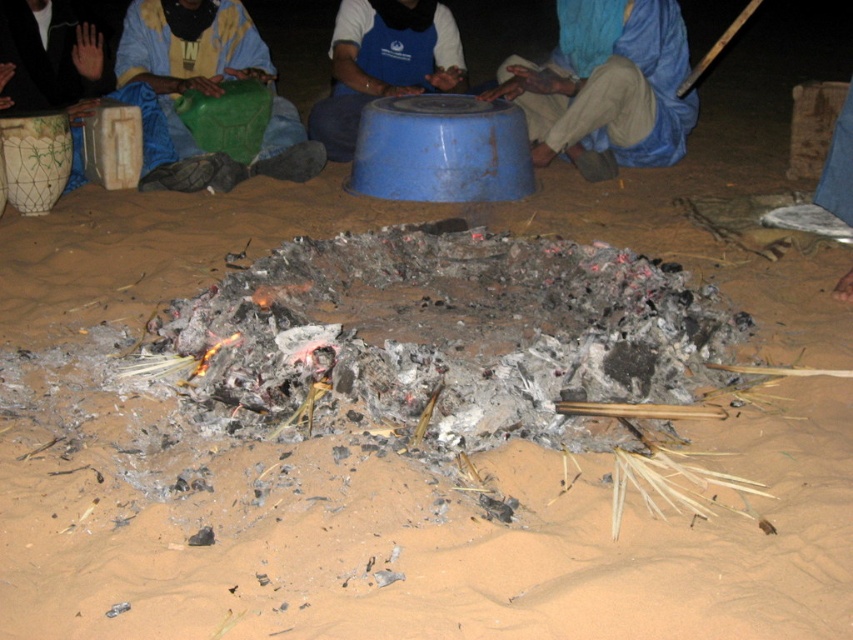
You are planning to use the blue plastic bowl at center to cover the blue fabric headscarf at upper center. Based on their sizes, will the bowl fit over the headscarf?

The blue fabric headscarf at upper center might be wider than blue plastic bowl at center, so there is a possibility that the bowl may not fully cover the headscarf.